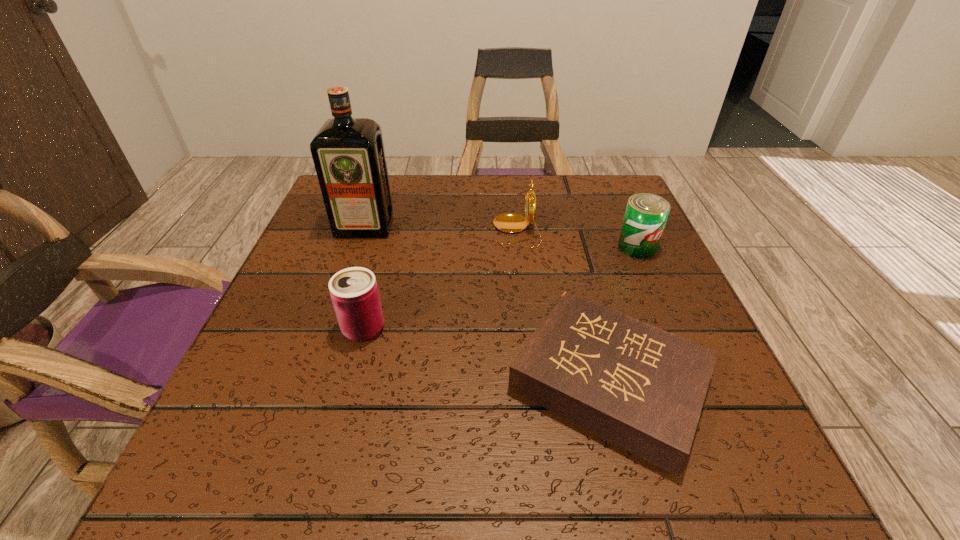
Locate an element on the screen. object that is positioned at the near right corner is located at coordinates (642, 388).

Where is `free space at the far edge of the desktop`? free space at the far edge of the desktop is located at coordinates (539, 224).

The image size is (960, 540). Find the location of `vacant space at the near edge of the desktop`. vacant space at the near edge of the desktop is located at coordinates pyautogui.click(x=617, y=460).

In order to click on free space at the left edge in this screenshot , I will do `click(319, 276)`.

Find the location of `vacant point at the right edge`. vacant point at the right edge is located at coordinates (719, 390).

Image resolution: width=960 pixels, height=540 pixels. In the image, there is a desktop. Find the location of `blank space at the far right corner`. blank space at the far right corner is located at coordinates (604, 179).

In the image, there is a desktop. Identify the location of free space at the near right corner. This screenshot has width=960, height=540. (709, 444).

The width and height of the screenshot is (960, 540). I want to click on free space that is in between the pocket watch and the nearer can, so click(440, 280).

Where is `empty space between the farther can and the nearer can`? This screenshot has width=960, height=540. empty space between the farther can and the nearer can is located at coordinates coord(500,288).

Where is `free space between the right can and the nearer can`? Image resolution: width=960 pixels, height=540 pixels. free space between the right can and the nearer can is located at coordinates (500, 288).